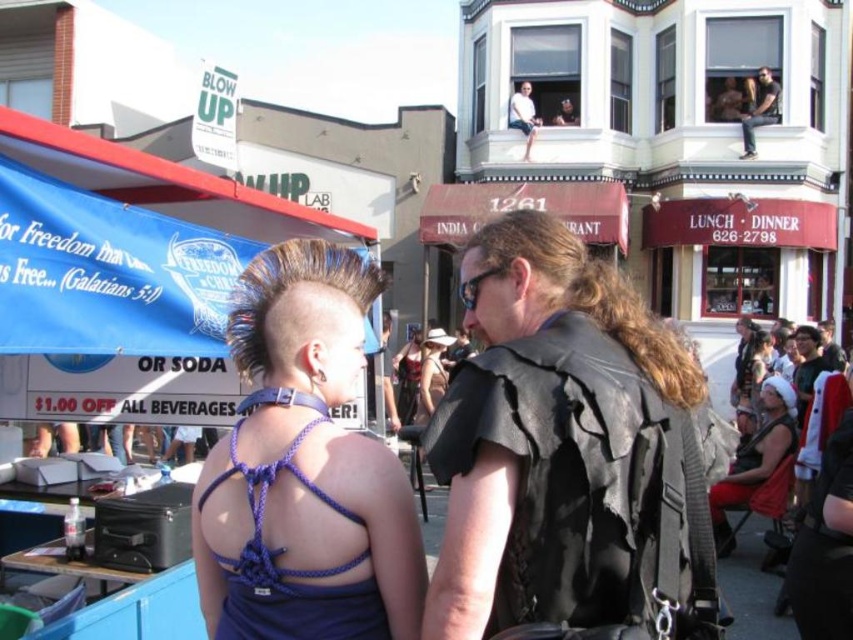
You are standing at the starting point and want to reach the leather vest at center. The path ahead has a 20 meter limit before a barrier. Will you be able to reach it?

The leather vest at center is 21.75 meters away from the viewer. Since the path only allows 20 meters before a barrier, you cannot reach the leather vest at center as it is beyond the allowed distance.

Consider the image. You are a photographer trying to capture the perfect shot of the leather vest at center and the light blue denim shorts at upper center. Based on their positions, which object should you focus on first if you want to include both in your frame without moving the camera?

You should focus on the light blue denim shorts at upper center first because the leather vest at center is to the right of it, so by centering the light blue denim shorts at upper center, you can ensure both objects are within the frame.

You are a photographer trying to capture both the matte black dress at center and the matte black backpack at center in the same frame. Which object should you focus on first if you want to ensure both are in focus without adjusting your camera settings?

The matte black dress at center is thinner than the matte black backpack at center, so focusing on the matte black dress at center first would allow both objects to remain in focus since it is closer to the camera.